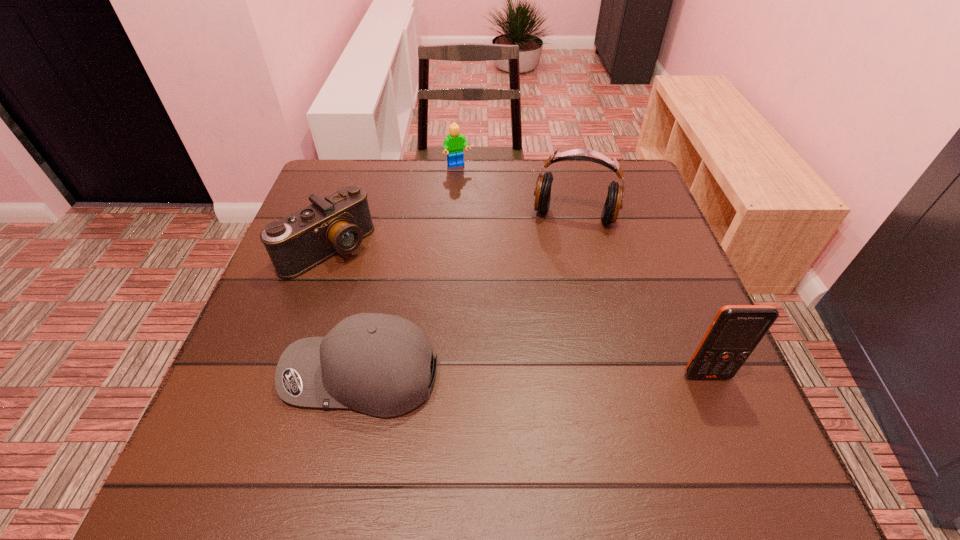
Locate an element on the screen. vacant area situated on the lens of the camera is located at coordinates (376, 289).

I want to click on vacant area located 0.280m on the lens of the camera, so [437, 339].

Where is `vacant space situated on the lens of the camera`? vacant space situated on the lens of the camera is located at coordinates pos(413,320).

Locate an element on the screen. This screenshot has height=540, width=960. vacant space located on the face of the farthest object is located at coordinates (512, 262).

The height and width of the screenshot is (540, 960). I want to click on vacant space positioned 0.290m on the face of the farthest object, so click(495, 233).

The image size is (960, 540). What are the coordinates of `free location located on the face of the farthest object` in the screenshot? It's located at (489, 220).

Image resolution: width=960 pixels, height=540 pixels. I want to click on headset situated at the far edge, so click(542, 192).

Locate an element on the screen. Lego that is positioned at the far edge is located at coordinates (454, 143).

Where is `baseball cap at the near edge`? The height and width of the screenshot is (540, 960). baseball cap at the near edge is located at coordinates pos(379,364).

Find the location of a particular element. cellular telephone present at the near edge is located at coordinates (736, 330).